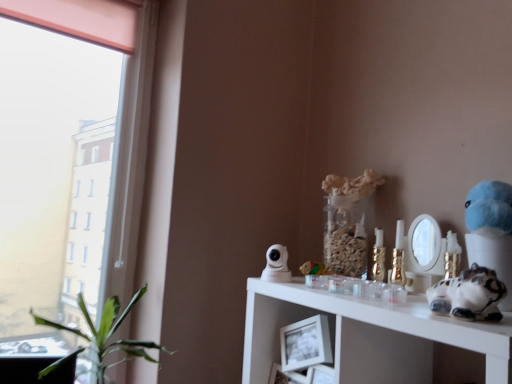
What do you see at coordinates (469, 295) in the screenshot? Image resolution: width=512 pixels, height=384 pixels. I see `white glossy cat figurine at right, the 2th toy when ordered from back to front` at bounding box center [469, 295].

You are a GUI agent. You are given a task and a screenshot of the screen. Output one action in this format:
    pyautogui.click(x=<x>, y=<y>)
    Task: Click on the wooden block at center, which is counted as the second toy, starting from the front
    This screenshot has height=384, width=512.
    Given the screenshot: What is the action you would take?
    pyautogui.click(x=313, y=273)

From the picture: What is the approximate height of white glossy cat figurine at right, the 1th figurine when ordered from right to left?

white glossy cat figurine at right, the 1th figurine when ordered from right to left, is 12.12 inches tall.

Locate an element on the screen. The height and width of the screenshot is (384, 512). green leafy plant at left is located at coordinates (103, 337).

Locate an element on the screen. The height and width of the screenshot is (384, 512). white glossy security camera at upper center, marked as the first figurine in a back-to-front arrangement is located at coordinates (276, 265).

Visually, is green leafy plant at left positioned to the left or to the right of white glossy cat figurine at right, marked as the 1th toy in a front-to-back arrangement?

From the image, it's evident that green leafy plant at left is to the left of white glossy cat figurine at right, marked as the 1th toy in a front-to-back arrangement.

From a real-world perspective, who is located lower, green leafy plant at left or white glossy cat figurine at right, marked as the 1th toy in a front-to-back arrangement?

green leafy plant at left.

In terms of size, does green leafy plant at left appear bigger or smaller than white glossy cat figurine at right, placed as the 1th toy when sorted from right to left?

Clearly, green leafy plant at left is larger in size than white glossy cat figurine at right, placed as the 1th toy when sorted from right to left.

Is green leafy plant at left shorter than white glossy cat figurine at right, the 2th toy when ordered from left to right?

No, green leafy plant at left is not shorter than white glossy cat figurine at right, the 2th toy when ordered from left to right.

Which of these two, white glossy cat figurine at right, the 2th toy when ordered from left to right, or green leafy plant at left, is bigger?

With larger size is green leafy plant at left.

Does white glossy cat figurine at right, placed as the 1th toy when sorted from right to left, turn towards green leafy plant at left?

No, white glossy cat figurine at right, placed as the 1th toy when sorted from right to left, is not oriented towards green leafy plant at left.

Is white glossy cat figurine at right, marked as the 1th toy in a front-to-back arrangement, inside or outside of green leafy plant at left?

white glossy cat figurine at right, marked as the 1th toy in a front-to-back arrangement, is spatially situated outside green leafy plant at left.

Considering the positions of objects white glossy cat figurine at right, the 2th toy when ordered from back to front, and green leafy plant at left in the image provided, who is more to the right, white glossy cat figurine at right, the 2th toy when ordered from back to front, or green leafy plant at left?

From the viewer's perspective, white glossy cat figurine at right, the 2th toy when ordered from back to front, appears more on the right side.

Based on the photo, in terms of height, does green leafy plant at left look taller or shorter compared to wooden block at center, which is counted as the 1th toy, starting from the left?

Considering their sizes, green leafy plant at left has more height than wooden block at center, which is counted as the 1th toy, starting from the left.

In the scene shown: From the image's perspective, between green leafy plant at left and wooden block at center, which is counted as the second toy, starting from the front, who is located below?

green leafy plant at left, from the image's perspective.

Is green leafy plant at left looking in the opposite direction of wooden block at center, the 1th toy viewed from the back?

No, green leafy plant at left is not facing the opposite direction of wooden block at center, the 1th toy viewed from the back.

Considering the sizes of objects white glossy cat figurine at right, arranged as the second figurine when viewed from the back, and green leafy plant at left in the image provided, who is bigger, white glossy cat figurine at right, arranged as the second figurine when viewed from the back, or green leafy plant at left?

green leafy plant at left is bigger.

Does white glossy cat figurine at right, arranged as the second figurine when viewed from the back, turn towards green leafy plant at left?

No, white glossy cat figurine at right, arranged as the second figurine when viewed from the back, is not facing towards green leafy plant at left.

Is white glossy cat figurine at right, the second figurine viewed from the left, at the right side of green leafy plant at left?

Indeed, white glossy cat figurine at right, the second figurine viewed from the left, is positioned on the right side of green leafy plant at left.

How many degrees apart are the facing directions of white glossy cat figurine at right, the second figurine viewed from the left, and green leafy plant at left?

They differ by 87.1 degrees in their facing directions.

From the picture: From the image's perspective, is gold metallic candle holder at upper right positioned above or below white glossy cat figurine at right, arranged as the second figurine when viewed from the back?

→ Based on their image positions, gold metallic candle holder at upper right is located beneath white glossy cat figurine at right, arranged as the second figurine when viewed from the back.

Is gold metallic candle holder at upper right to the left of white glossy cat figurine at right, arranged as the second figurine when viewed from the back, from the viewer's perspective?

Correct, you'll find gold metallic candle holder at upper right to the left of white glossy cat figurine at right, arranged as the second figurine when viewed from the back.

In terms of size, does gold metallic candle holder at upper right appear bigger or smaller than white glossy cat figurine at right, the 1th figurine positioned from the front?

Clearly, gold metallic candle holder at upper right is smaller in size than white glossy cat figurine at right, the 1th figurine positioned from the front.

Is gold metallic candle holder at upper right completely or partially outside of white glossy cat figurine at right, arranged as the second figurine when viewed from the back?

Yes, gold metallic candle holder at upper right is outside of white glossy cat figurine at right, arranged as the second figurine when viewed from the back.

Does wooden block at center, which is counted as the 1th toy, starting from the left, appear on the left side of gold metallic candle holder at upper right?

Yes.

How many degrees apart are the facing directions of wooden block at center, which is counted as the 1th toy, starting from the left, and gold metallic candle holder at upper right?

0.406 degrees separate the facing orientations of wooden block at center, which is counted as the 1th toy, starting from the left, and gold metallic candle holder at upper right.

Is wooden block at center, which is the 2th toy in right-to-left order, positioned with its back to gold metallic candle holder at upper right?

That's not correct — wooden block at center, which is the 2th toy in right-to-left order, is not looking away from gold metallic candle holder at upper right.

From a real-world perspective, is wooden block at center, the 1th toy viewed from the back, physically located above or below gold metallic candle holder at upper right?

Clearly, from a real-world perspective, wooden block at center, the 1th toy viewed from the back, is below gold metallic candle holder at upper right.

Is white glossy cat figurine at right, arranged as the second figurine when viewed from the back, to the right of white glossy security camera at upper center, marked as the first figurine in a back-to-front arrangement, from the viewer's perspective?

Correct, you'll find white glossy cat figurine at right, arranged as the second figurine when viewed from the back, to the right of white glossy security camera at upper center, marked as the first figurine in a back-to-front arrangement.

Is white glossy cat figurine at right, arranged as the second figurine when viewed from the back, wider than white glossy security camera at upper center, marked as the second figurine in a right-to-left arrangement?

Correct, the width of white glossy cat figurine at right, arranged as the second figurine when viewed from the back, exceeds that of white glossy security camera at upper center, marked as the second figurine in a right-to-left arrangement.

Consider the image. Is white glossy cat figurine at right, the 1th figurine when ordered from right to left, smaller than white glossy security camera at upper center, which ranks as the 1th figurine in left-to-right order?

Answer: No, white glossy cat figurine at right, the 1th figurine when ordered from right to left, is not smaller than white glossy security camera at upper center, which ranks as the 1th figurine in left-to-right order.

Is the position of white glossy cat figurine at right, the 1th figurine positioned from the front, more distant than that of white glossy security camera at upper center, marked as the first figurine in a back-to-front arrangement?

No, white glossy cat figurine at right, the 1th figurine positioned from the front, is closer to the camera.

Where is `houseplant behind the white glossy cat figurine at right, the 2th toy when ordered from back to front`? This screenshot has width=512, height=384. houseplant behind the white glossy cat figurine at right, the 2th toy when ordered from back to front is located at coordinates (103, 337).

Locate an element on the screen. houseplant that appears on the left of white glossy cat figurine at right, placed as the 1th toy when sorted from right to left is located at coordinates (103, 337).

Looking at the image, which one is located further to gold metallic candle holder at upper right, white glossy cat figurine at right, the 2th toy when ordered from back to front, or white glossy cat figurine at right, the second figurine viewed from the left?

white glossy cat figurine at right, the 2th toy when ordered from back to front, is positioned further to the anchor gold metallic candle holder at upper right.

Looking at the image, which one is located further to white glossy security camera at upper center, marked as the first figurine in a back-to-front arrangement, green leafy plant at left or white glossy cat figurine at right, marked as the 1th toy in a front-to-back arrangement?

green leafy plant at left is positioned further to the anchor white glossy security camera at upper center, marked as the first figurine in a back-to-front arrangement.

Estimate the real-world distances between objects in this image. Which object is further from green leafy plant at left, white glossy cat figurine at right, placed as the 1th toy when sorted from right to left, or wooden block at center, which is the 2th toy in right-to-left order?

white glossy cat figurine at right, placed as the 1th toy when sorted from right to left, is positioned further to the anchor green leafy plant at left.

Based on the photo, looking at the image, which one is located closer to wooden block at center, the 1th toy viewed from the back, white glossy cat figurine at right, the 2th toy when ordered from left to right, or white glossy cat figurine at right, arranged as the second figurine when viewed from the back?

white glossy cat figurine at right, the 2th toy when ordered from left to right.

Consider the image. Based on their spatial positions, is white glossy cat figurine at right, the 1th figurine when ordered from right to left, or white glossy security camera at upper center, which is counted as the 2th figurine, starting from the front, closer to white glossy cat figurine at right, placed as the 1th toy when sorted from right to left?

white glossy cat figurine at right, the 1th figurine when ordered from right to left, is positioned closer to the anchor white glossy cat figurine at right, placed as the 1th toy when sorted from right to left.

From the image, which object appears to be nearer to white glossy cat figurine at right, the 1th figurine when ordered from right to left, white glossy security camera at upper center, marked as the second figurine in a right-to-left arrangement, or wooden block at center, which is counted as the 1th toy, starting from the left?

The object closer to white glossy cat figurine at right, the 1th figurine when ordered from right to left, is wooden block at center, which is counted as the 1th toy, starting from the left.

Based on their spatial positions, is green leafy plant at left or white glossy cat figurine at right, marked as the 1th toy in a front-to-back arrangement, further from wooden block at center, the 1th toy viewed from the back?

The object further to wooden block at center, the 1th toy viewed from the back, is green leafy plant at left.

Based on their spatial positions, is wooden block at center, which is counted as the second toy, starting from the front, or green leafy plant at left further from white glossy security camera at upper center, which ranks as the 1th figurine in left-to-right order?

green leafy plant at left is positioned further to the anchor white glossy security camera at upper center, which ranks as the 1th figurine in left-to-right order.

I want to click on candle holder positioned between white glossy cat figurine at right, the second figurine viewed from the left, and wooden block at center, which is the 2th toy in right-to-left order, from near to far, so click(378, 256).

At what (x,y) coordinates should I click in order to perform the action: click on candle holder situated between white glossy security camera at upper center, marked as the second figurine in a right-to-left arrangement, and white glossy cat figurine at right, the 1th figurine positioned from the front, from left to right. Please return your answer as a coordinate pair (x, y). Looking at the image, I should click on (378, 256).

Identify the location of figurine between green leafy plant at left and gold metallic candle holder at upper right in the horizontal direction. (276, 265).

Locate an element on the screen. Image resolution: width=512 pixels, height=384 pixels. figurine located between green leafy plant at left and wooden block at center, the 1th toy viewed from the back, in the left-right direction is located at coordinates (276, 265).